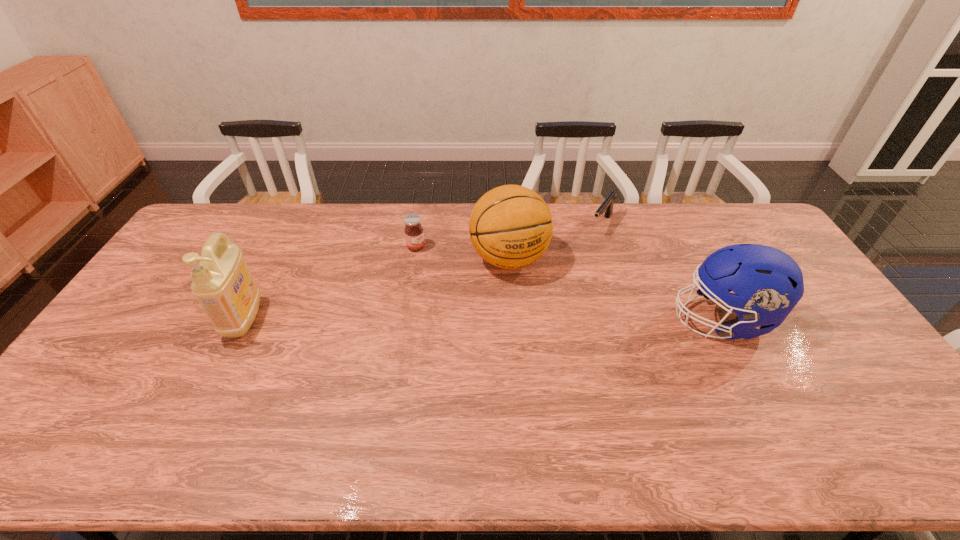
Locate an element on the screen. This screenshot has height=540, width=960. free space on the desktop that is between the leftmost object and the football helmet and is positioned on the label side of the second object from left to right is located at coordinates (537, 319).

Find the location of a particular element. The width and height of the screenshot is (960, 540). vacant space on the desktop that is between the detergent and the football helmet and is positioned on the surface of the third object from right to left near the brand logo is located at coordinates (539, 319).

Image resolution: width=960 pixels, height=540 pixels. In order to click on free spot on the desktop that is between the leftmost object and the rightmost object and is positioned at the muzzle of the pistol in this screenshot , I will do `click(533, 319)`.